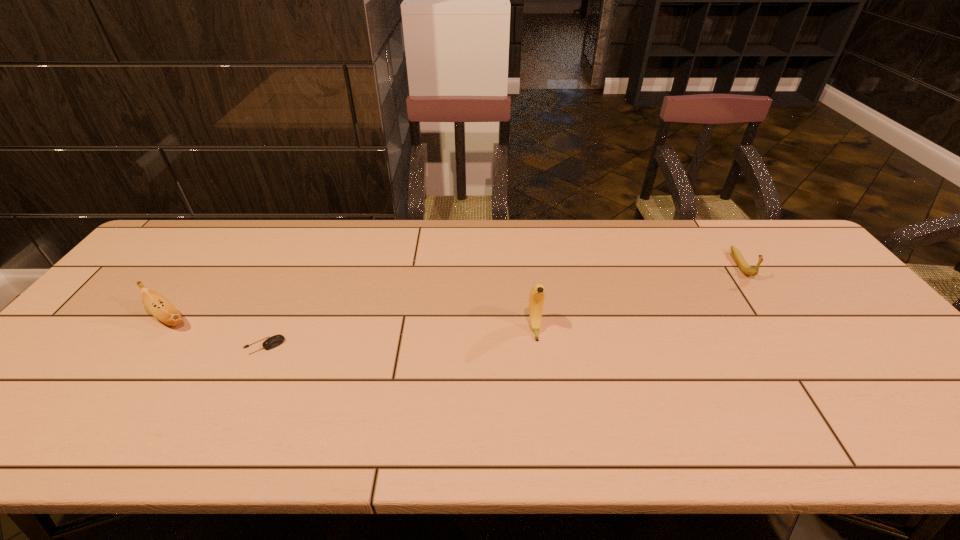
Where is `the second object from right to left`? This screenshot has width=960, height=540. the second object from right to left is located at coordinates (537, 294).

Locate an element on the screen. the tallest object is located at coordinates (537, 294).

Identify the location of the leftmost object. The image size is (960, 540). (157, 305).

You are a GUI agent. You are given a task and a screenshot of the screen. Output one action in this format:
    pyautogui.click(x=<x>, y=<y>)
    Task: Click on the rightmost banana
    Image resolution: width=960 pixels, height=540 pixels.
    Given the screenshot: What is the action you would take?
    pyautogui.click(x=741, y=263)

Locate an element on the screen. The height and width of the screenshot is (540, 960). the rightmost object is located at coordinates point(741,263).

Where is `the shortest object`? This screenshot has height=540, width=960. the shortest object is located at coordinates (276, 340).

This screenshot has width=960, height=540. What are the coordinates of `the third object from right to left` in the screenshot? It's located at (276, 340).

Find the location of a particular element. vacant area located from the stem of the third object from left to right is located at coordinates (540, 370).

At what (x,y) coordinates should I click in order to perform the action: click on free location located on the right of the leftmost object. Please return your answer as a coordinate pair (x, y). This screenshot has height=540, width=960. Looking at the image, I should click on (255, 319).

The width and height of the screenshot is (960, 540). Find the location of `free spot located at the stem of the rightmost banana`. free spot located at the stem of the rightmost banana is located at coordinates (783, 328).